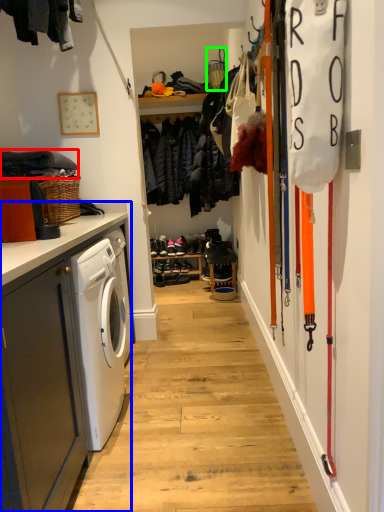
Question: Based on their relative distances, which object is nearer to clothing (highlighted by a red box)? Choose from cabinetry (highlighted by a blue box) and basket (highlighted by a green box).

Choices:
 (A) cabinetry
 (B) basket

Answer: (A)